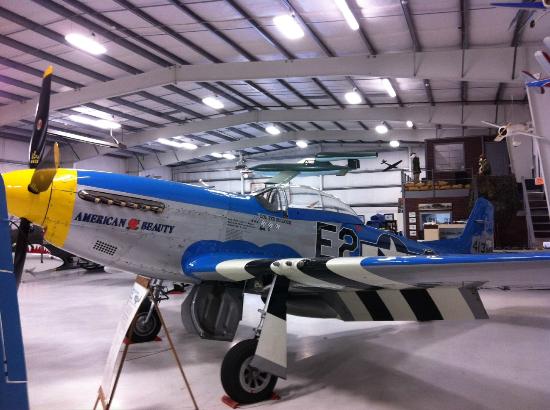
At what (x,y) coordinates should I click in order to perform the action: click on stairs. Please return your answer as a coordinate pair (x, y). Image resolution: width=550 pixels, height=410 pixels. Looking at the image, I should click on (537, 211).